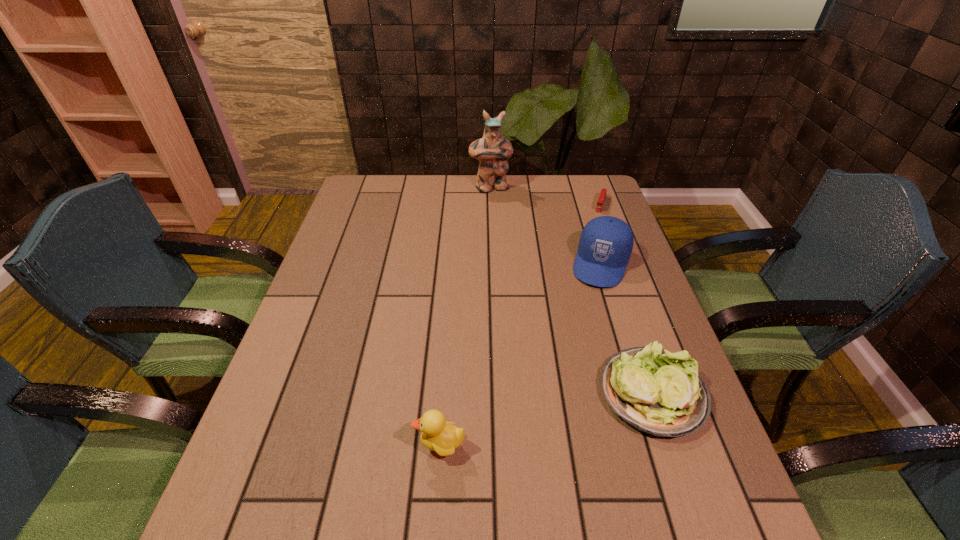
Identify the location of vacant region located 0.340m on the left of the lettuce. (444, 393).

At what (x,y) coordinates should I click in order to perform the action: click on free space located 0.150m on the front-facing side of the farthest object. Please return your answer as a coordinate pair (x, y). The width and height of the screenshot is (960, 540). Looking at the image, I should click on (505, 218).

Where is `vacant area located 0.390m on the front-facing side of the farthest object`? This screenshot has height=540, width=960. vacant area located 0.390m on the front-facing side of the farthest object is located at coordinates (524, 265).

At what (x,y) coordinates should I click in order to perform the action: click on free space located 0.320m on the front-facing side of the farthest object. Please return your answer as a coordinate pair (x, y). Looking at the image, I should click on click(517, 250).

You are a GUI agent. You are given a task and a screenshot of the screen. Output one action in this format:
    pyautogui.click(x=<x>, y=<y>)
    Task: Click on the free space located on the front-facing side of the cap
    
    Given the screenshot: What is the action you would take?
    pyautogui.click(x=566, y=382)

Where is `vacant area located 0.330m on the front-facing side of the cap`? vacant area located 0.330m on the front-facing side of the cap is located at coordinates (566, 382).

The height and width of the screenshot is (540, 960). Find the location of `blank space located 0.180m on the front-facing side of the cap`. blank space located 0.180m on the front-facing side of the cap is located at coordinates (582, 334).

Find the location of a particular element. Image resolution: width=960 pixels, height=540 pixels. free point located on the front-facing side of the shortest object is located at coordinates (580, 280).

The width and height of the screenshot is (960, 540). What are the coordinates of `vacant space situated 0.300m on the front-facing side of the shortest object` in the screenshot? It's located at (584, 267).

Locate an element on the screen. vacant space located on the front-facing side of the shortest object is located at coordinates (596, 227).